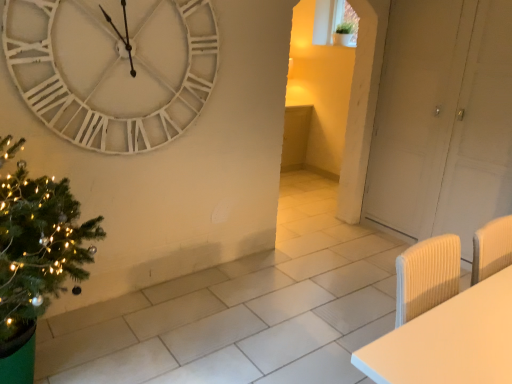
Question: From a real-world perspective, is white wooden clock at upper left physically located above or below white matte door at right?

Choices:
 (A) above
 (B) below

Answer: (A)

Question: Which is correct: white wooden clock at upper left is inside white matte door at right, or outside of it?

Choices:
 (A) outside
 (B) inside

Answer: (A)

Question: Estimate the real-world distances between objects in this image. Which object is farther from the white matte door at right?

Choices:
 (A) white wooden clock at upper left
 (B) white ribbed chair at lower right
 (C) green textured christmas tree at left

Answer: (C)

Question: Considering the real-world distances, which object is closest to the white matte door at right?

Choices:
 (A) green textured christmas tree at left
 (B) white ribbed chair at lower right
 (C) white wooden clock at upper left

Answer: (C)